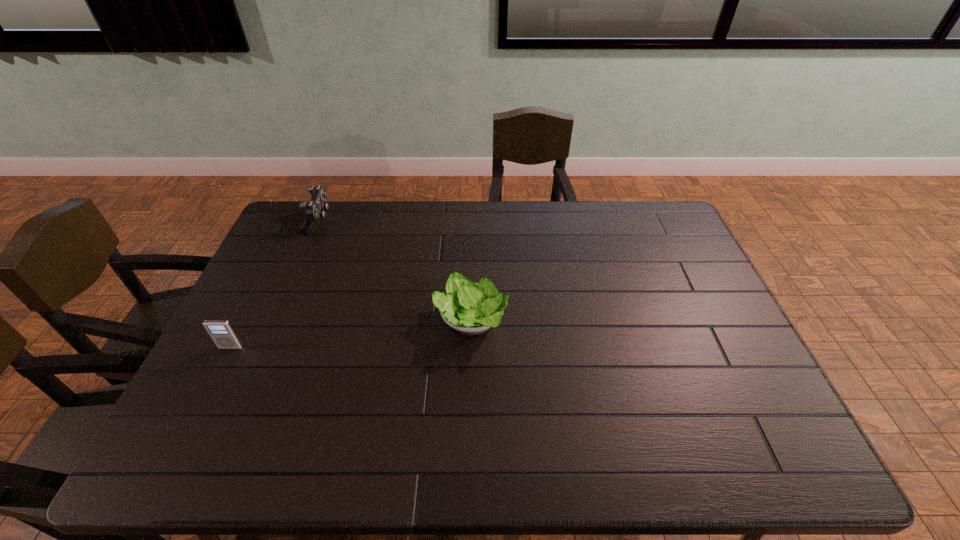
You are a GUI agent. You are given a task and a screenshot of the screen. Output one action in this format:
    pyautogui.click(x=<x>, y=<y>)
    Task: Click on the object at the far left corner
    This screenshot has height=540, width=960.
    Given the screenshot: What is the action you would take?
    pyautogui.click(x=314, y=210)

This screenshot has width=960, height=540. What are the coordinates of `vacant space at the far edge of the desktop` in the screenshot? It's located at (356, 205).

Identify the location of vacant area at the near edge of the desktop. The height and width of the screenshot is (540, 960). pos(689,469).

In the image, there is a desktop. Identify the location of free region at the left edge. (214, 380).

Locate an element on the screen. The width and height of the screenshot is (960, 540). free space at the right edge of the desktop is located at coordinates (653, 275).

This screenshot has height=540, width=960. Identify the location of vacant space at the far right corner. (682, 234).

In the image, there is a desktop. Identify the location of vacant area at the near right corner. The height and width of the screenshot is (540, 960). (759, 463).

Locate an element on the screen. The image size is (960, 540). blank region between the leftmost object and the second object from right to left is located at coordinates (275, 284).

Locate an element on the screen. This screenshot has width=960, height=540. free space between the rightmost object and the farthest object is located at coordinates (395, 271).

You are a GUI agent. You are given a task and a screenshot of the screen. Output one action in this format:
    pyautogui.click(x=<x>, y=<y>)
    Task: Click on the unoccupied position between the control and the iPod
    This screenshot has width=960, height=540.
    Given the screenshot: What is the action you would take?
    click(275, 284)